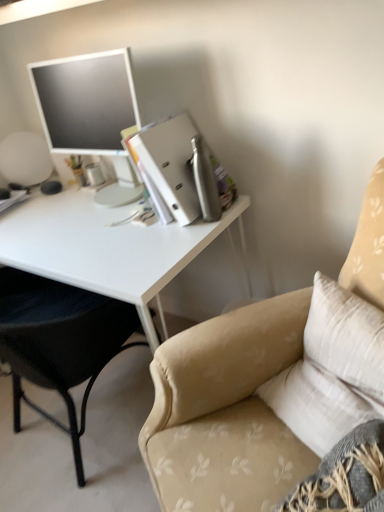
Question: Is metallic silver binder at upper right wider than beige fabric chair at left, the first chair positioned from the left?

Choices:
 (A) no
 (B) yes

Answer: (A)

Question: Is metallic silver binder at upper right facing away from beige fabric chair at left, the first chair positioned from the left?

Choices:
 (A) yes
 (B) no

Answer: (B)

Question: Can we say metallic silver binder at upper right lies outside beige fabric chair at left, the first chair positioned from the left?

Choices:
 (A) yes
 (B) no

Answer: (A)

Question: From the image's perspective, does metallic silver binder at upper right appear lower than beige fabric chair at left, the first chair positioned from the left?

Choices:
 (A) no
 (B) yes

Answer: (A)

Question: Is beige fabric chair at left, which is the 2th chair in right-to-left order, a part of metallic silver binder at upper right?

Choices:
 (A) yes
 (B) no

Answer: (B)

Question: Choose the correct answer: Is beige fabric chair at upper right, which appears as the 1th chair when viewed from the right, inside white glossy desk at left or outside it?

Choices:
 (A) outside
 (B) inside

Answer: (A)

Question: Looking at their shapes, would you say beige fabric chair at upper right, which appears as the 1th chair when viewed from the right, is wider or thinner than white glossy desk at left?

Choices:
 (A) thin
 (B) wide

Answer: (B)

Question: Is point (246, 494) closer or farther from the camera than point (89, 211)?

Choices:
 (A) farther
 (B) closer

Answer: (B)

Question: From the image's perspective, is beige fabric chair at upper right, which appears as the 1th chair when viewed from the right, above or below white glossy desk at left?

Choices:
 (A) above
 (B) below

Answer: (B)

Question: Which is correct: beige fabric chair at left, which is the 2th chair in right-to-left order, is inside metallic silver binder at upper right, or outside of it?

Choices:
 (A) outside
 (B) inside

Answer: (A)

Question: Considering the relative positions of beige fabric chair at left, which is the 2th chair in right-to-left order, and metallic silver binder at upper right in the image provided, is beige fabric chair at left, which is the 2th chair in right-to-left order, to the left or to the right of metallic silver binder at upper right?

Choices:
 (A) left
 (B) right

Answer: (A)

Question: In terms of width, does beige fabric chair at left, the first chair positioned from the left, look wider or thinner when compared to metallic silver binder at upper right?

Choices:
 (A) wide
 (B) thin

Answer: (A)

Question: In the image, is beige fabric chair at left, which is the 2th chair in right-to-left order, positioned in front of or behind metallic silver binder at upper right?

Choices:
 (A) front
 (B) behind

Answer: (A)

Question: From the image's perspective, is white glossy desk at left above or below beige fabric chair at left, which is the 2th chair in right-to-left order?

Choices:
 (A) below
 (B) above

Answer: (B)

Question: Based on their positions, is white glossy desk at left located to the left or right of beige fabric chair at left, which is the 2th chair in right-to-left order?

Choices:
 (A) left
 (B) right

Answer: (B)